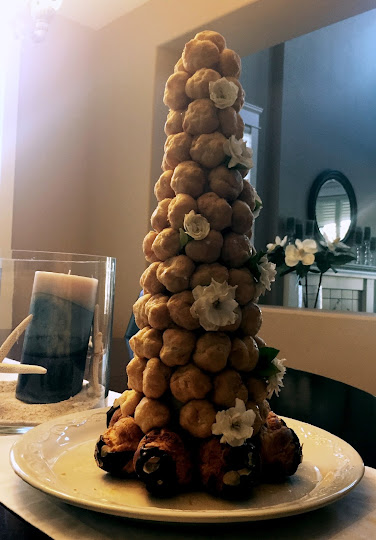
You are a GUI agent. You are given a task and a screenshot of the screen. Output one action in this format:
    pyautogui.click(x=<x>, y=<y>)
    Task: Click on the light
    The image size is (376, 540).
    Given the screenshot: What is the action you would take?
    pyautogui.click(x=10, y=108), pyautogui.click(x=5, y=133)